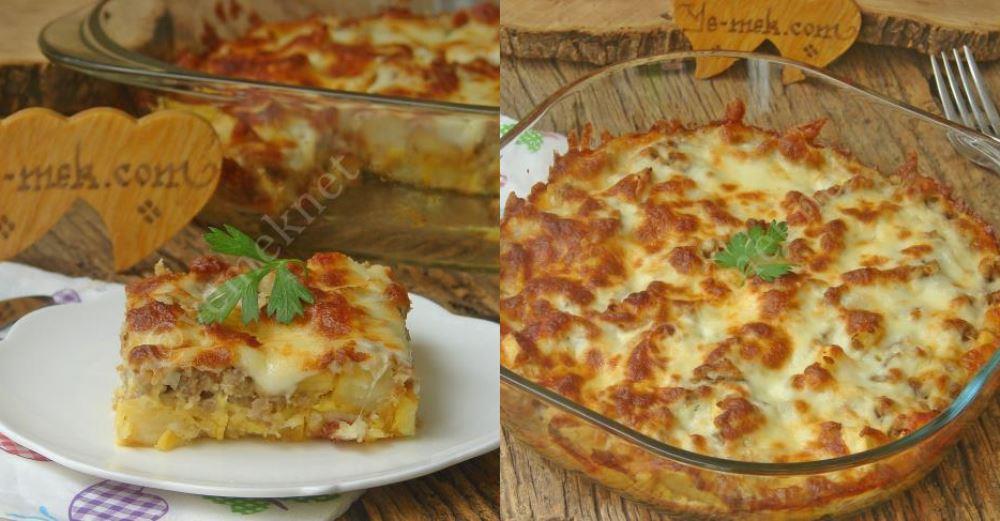
Find the location of a particular element. This screenshot has width=1000, height=521. fork is located at coordinates (966, 110).